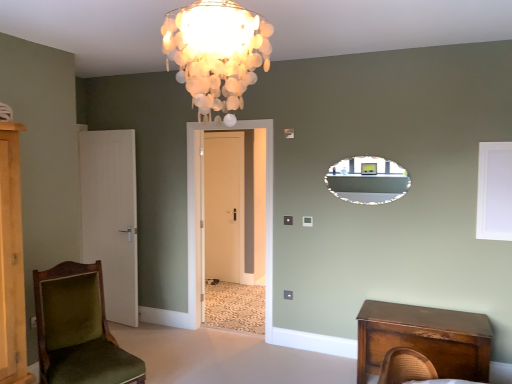
Question: Is point (263, 59) closer or farther from the camera than point (187, 248)?

Choices:
 (A) farther
 (B) closer

Answer: (B)

Question: From the image's perspective, is ivory shell chandelier at upper center positioned above or below white matte door at center, the 1th door viewed from the front?

Choices:
 (A) above
 (B) below

Answer: (A)

Question: Considering the real-world distances, which object is closest to the white matte door at left, which ranks as the 2th door in back-to-front order?

Choices:
 (A) ivory shell chandelier at upper center
 (B) white matte door at center, the third door positioned from the left
 (C) white matte window screen at upper right
 (D) wooden nightstand at lower right
 (E) velvet green chair at lower left

Answer: (B)

Question: Considering the real-world distances, which object is closest to the white matte window screen at upper right?

Choices:
 (A) white matte door at center, marked as the 1th door in a right-to-left arrangement
 (B) ivory shell chandelier at upper center
 (C) wooden nightstand at lower right
 (D) matte black mirror at upper center
 (E) white matte door at left, which is counted as the 1th door, starting from the left

Answer: (D)